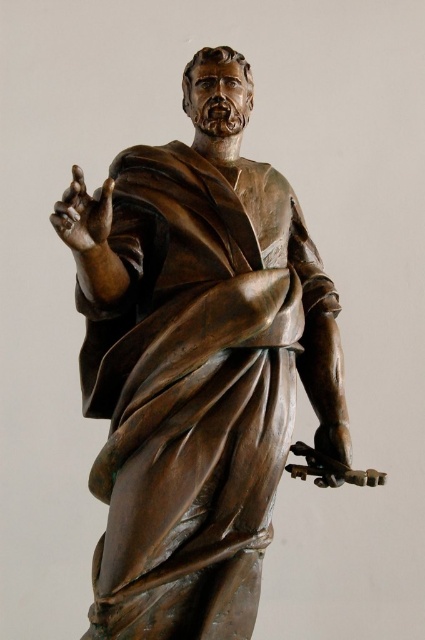
You are an art conservator assessing the bronze statue at center and the bronze statue hand at lower right. Which object is taller?

The bronze statue at center is taller than the bronze statue hand at lower right.

You are an art conservator examining the bronze statue. You notice two hands on the statue. Which hand has a greater width? The bronze statue hand at upper left or the bronze statue hand at lower right?

The bronze statue hand at upper left has a greater width than the bronze statue hand at lower right.